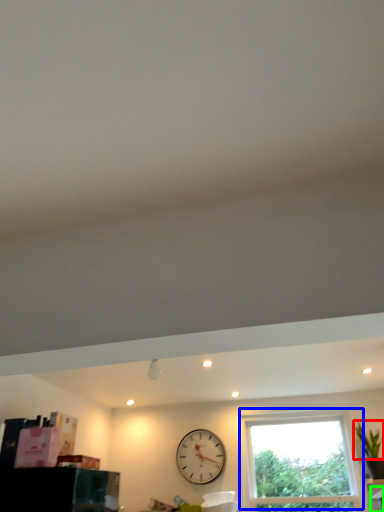
Question: Which object is the farthest from plant (highlighted by a red box)? Choose among these: window (highlighted by a blue box) or furniture (highlighted by a green box).

Choices:
 (A) window
 (B) furniture

Answer: (A)